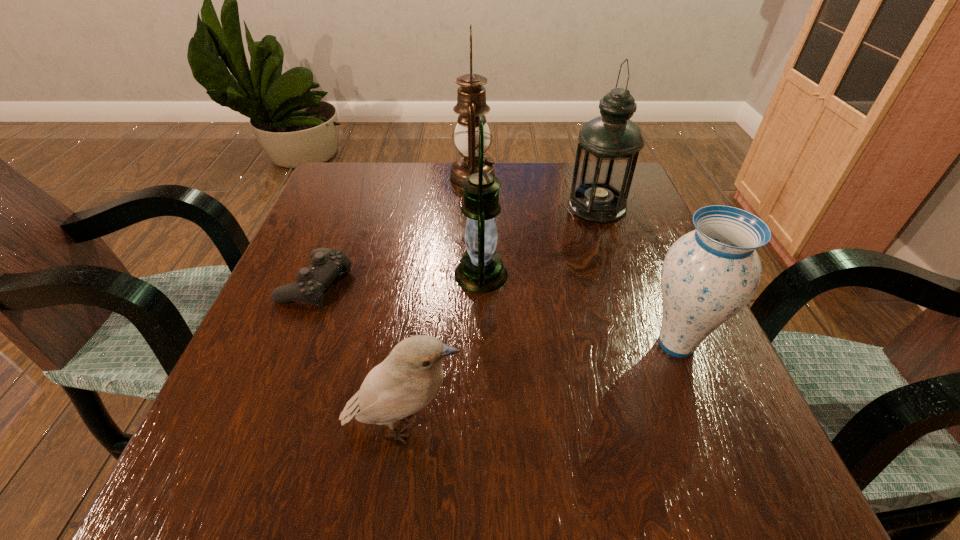
Where is `vase present at the right edge`? vase present at the right edge is located at coordinates (708, 275).

Locate an element on the screen. The image size is (960, 540). object positioned at the far right corner is located at coordinates (609, 145).

Where is `free space at the far edge of the desktop`? The height and width of the screenshot is (540, 960). free space at the far edge of the desktop is located at coordinates (498, 175).

In order to click on vacant region at the near edge of the desktop in this screenshot , I will do `click(368, 474)`.

This screenshot has height=540, width=960. I want to click on vacant space at the left edge, so click(276, 413).

Where is `free region at the right edge`? The width and height of the screenshot is (960, 540). free region at the right edge is located at coordinates (657, 224).

Identify the location of blank area at the far left corner. (341, 212).

This screenshot has height=540, width=960. Find the location of `free space at the near left corner of the desktop`. free space at the near left corner of the desktop is located at coordinates (251, 477).

Locate an element on the screen. The height and width of the screenshot is (540, 960). blank space at the near right corner is located at coordinates (687, 460).

The height and width of the screenshot is (540, 960). In order to click on free point between the shortest object and the lantern in this screenshot , I will do `click(398, 278)`.